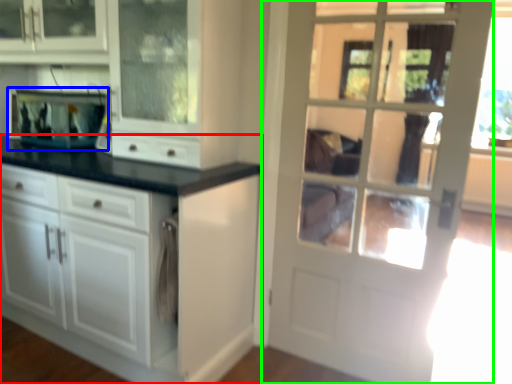
Question: Which object is the closest to the cabinetry (highlighted by a red box)? Choose among these: appliance (highlighted by a blue box) or door (highlighted by a green box).

Choices:
 (A) appliance
 (B) door

Answer: (B)